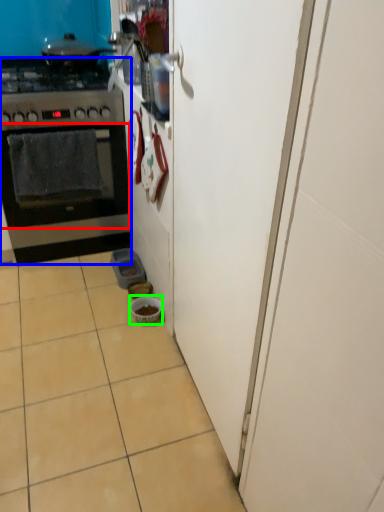
Question: Based on their relative distances, which object is farther from oven (highlighted by a red box)? Choose from kitchen appliance (highlighted by a blue box) and bowl (highlighted by a green box).

Choices:
 (A) kitchen appliance
 (B) bowl

Answer: (B)